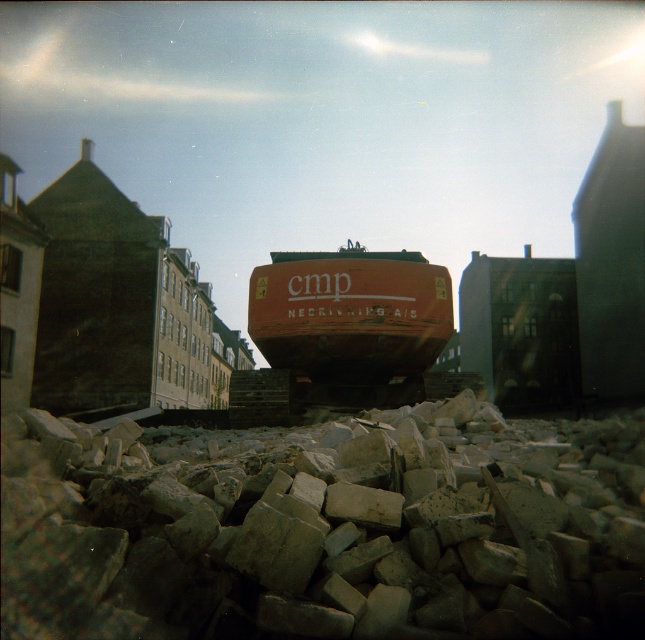
You are a construction worker who needs to move a heavy equipment from the rusty metal excavator at center to another location. The path you need to take goes over the gray rough gravel at lower center. Can the excavator safely move over the gravel? Please explain your reasoning based on the gravel and excavator details provided.

The gray rough gravel at lower center might be wider than the rusty metal excavator at center. However, the description does not provide information about the gravel stability or the excavator weight capacity. Without knowing if the gravel can support the excavator, it is uncertain whether it can safely move over the gravel.